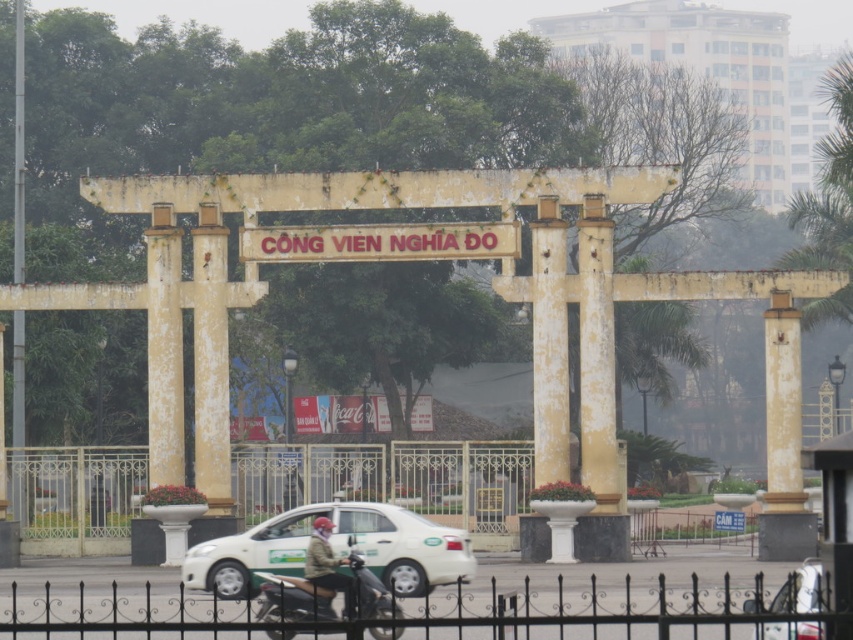
You are standing in front of the archway and want to take a photo of the black wrought iron fence at lower center. Where should you look to find it?

The black wrought iron fence at lower center is located at point [608,611].

You are a delivery driver who needs to pick up a package from the white matte taxi at center and deliver it to the person wearing the green fabric jacket at center. Given that your delivery robot has a maximum carrying distance of 10 feet, will you be able to complete the delivery without needing to recharge?

The white matte taxi at center and green fabric jacket at center are 8.12 feet apart, so yes, the delivery robot can complete the delivery without needing to recharge since the distance is within its 10 feet limit.